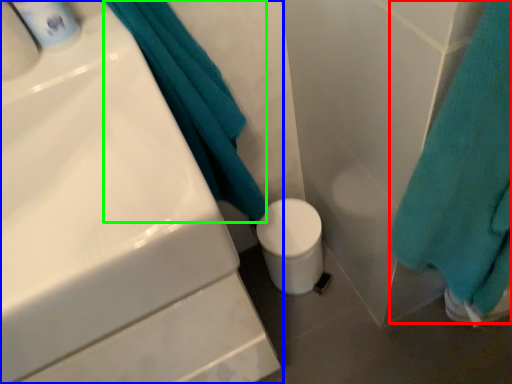
Question: Which object is positioned closest to bath towel (highlighted by a red box)? Select from sink (highlighted by a blue box) and bath towel (highlighted by a green box).

Choices:
 (A) sink
 (B) bath towel

Answer: (B)